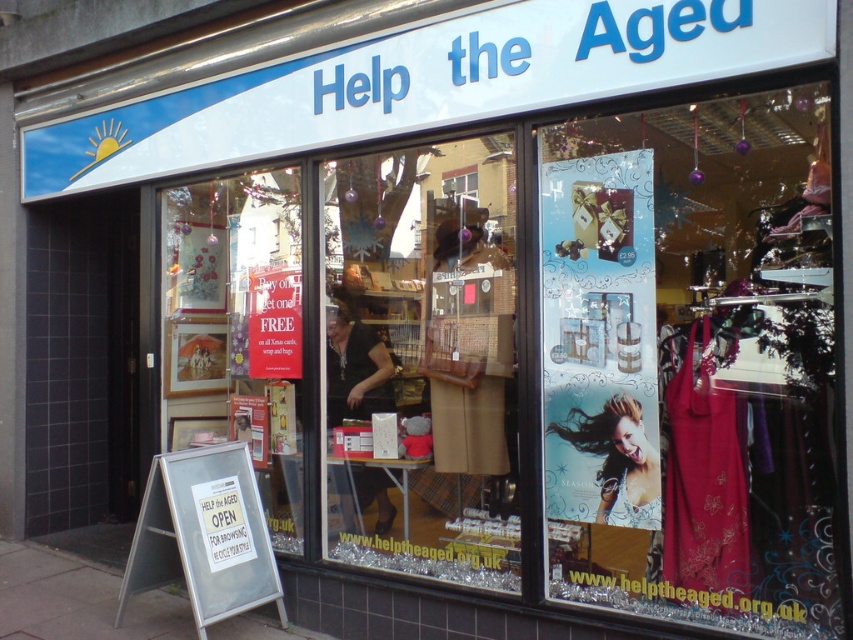
Question: Does gray concrete sidewalk at lower left have a greater width compared to shiny silver hair at center?

Choices:
 (A) no
 (B) yes

Answer: (B)

Question: Which point is farther from the camera taking this photo?

Choices:
 (A) (76, 570)
 (B) (595, 432)

Answer: (A)

Question: Can you confirm if metallic silver poster at center is smaller than gray concrete sidewalk at lower left?

Choices:
 (A) no
 (B) yes

Answer: (A)

Question: Which object is closer to the camera taking this photo?

Choices:
 (A) clear glass window at center
 (B) gray concrete sidewalk at lower left
 (C) matte black dress at center
 (D) shiny silver hair at center

Answer: (D)

Question: Which object is closer to the camera taking this photo?

Choices:
 (A) gray concrete sidewalk at lower left
 (B) clear glass window at center

Answer: (A)

Question: Is matte brown leather handbag at center to the right of shiny silver hair at center from the viewer's perspective?

Choices:
 (A) no
 (B) yes

Answer: (A)